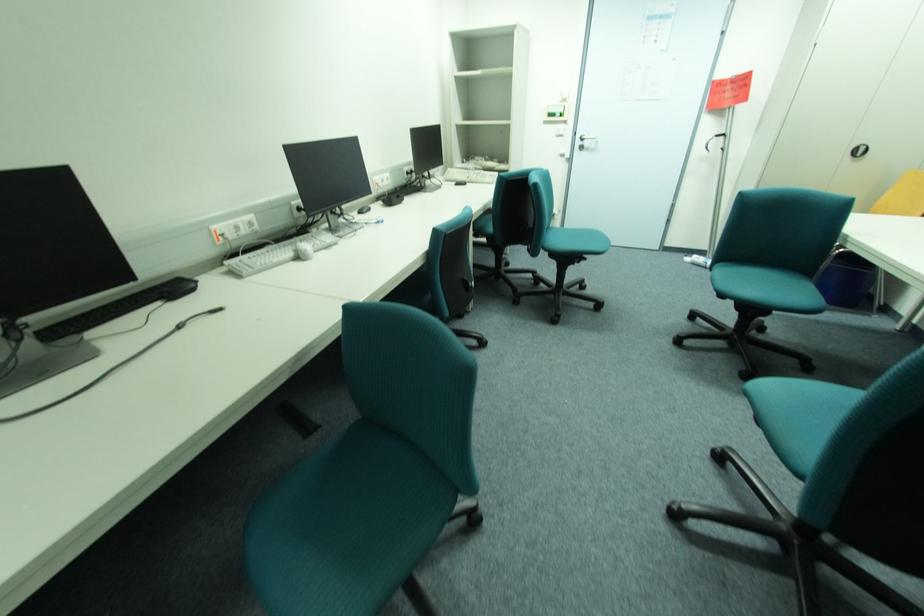
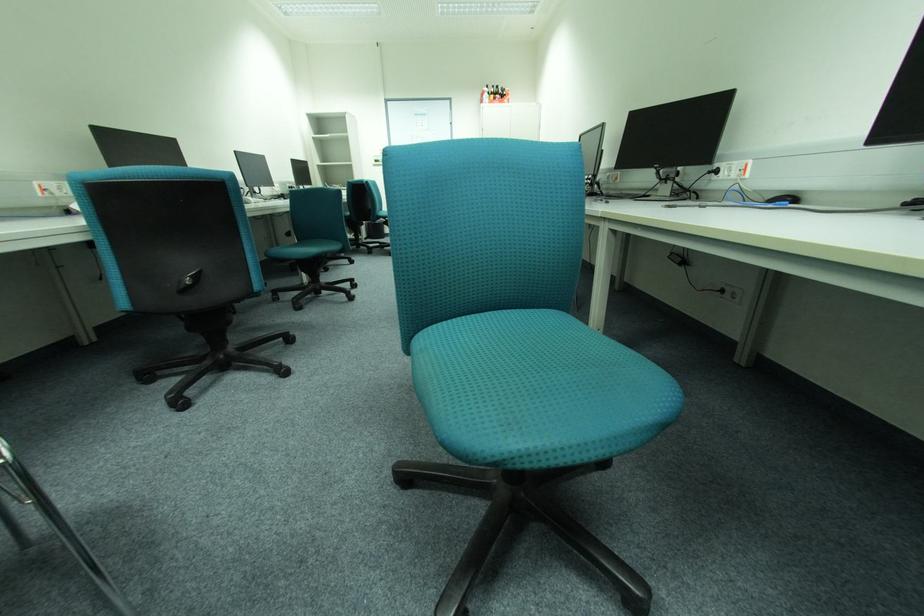
Question: In a continuous first-person perspective shot, in which direction is the camera moving?

Choices:
 (A) Left
 (B) Right
 (C) Forward
 (D) Backward

Answer: (D)